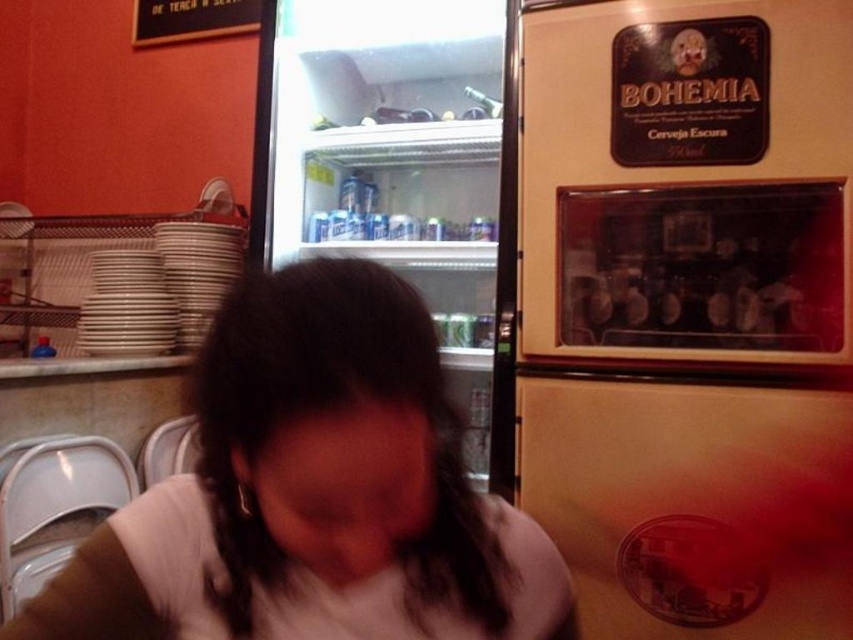
Does matte cream refrigerator at right come behind clear glass fridge at center?

No, it is not.

Is point (769, 102) farther from camera compared to point (426, 1)?

No, (769, 102) is closer to viewer.

Locate an element on the screen. matte cream refrigerator at right is located at coordinates (677, 275).

Can you confirm if matte cream refrigerator at right is smaller than white matte shirt at center?

Incorrect, matte cream refrigerator at right is not smaller in size than white matte shirt at center.

Between point (625, 154) and point (322, 316), which one is positioned behind?

The point (625, 154) is behind.

This screenshot has height=640, width=853. What do you see at coordinates (677, 275) in the screenshot?
I see `matte cream refrigerator at right` at bounding box center [677, 275].

What are the coordinates of `matte cream refrigerator at right` in the screenshot? It's located at (677, 275).

Which is above, matte cream refrigerator at right or black wood sign at upper left?

Positioned higher is black wood sign at upper left.

Can you confirm if matte cream refrigerator at right is taller than black wood sign at upper left?

Indeed, matte cream refrigerator at right has a greater height compared to black wood sign at upper left.

Locate an element on the screen. The image size is (853, 640). matte cream refrigerator at right is located at coordinates (677, 275).